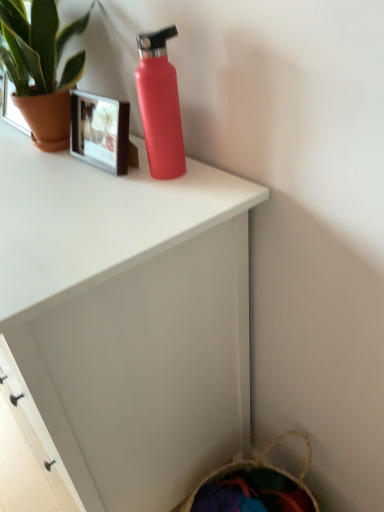
I want to click on free point in front of green matte plant at upper left, so click(48, 176).